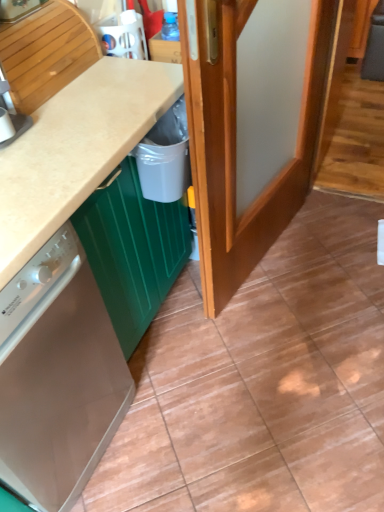
Identify the location of free space in front of beige matte countertop at center. The height and width of the screenshot is (512, 384). (188, 424).